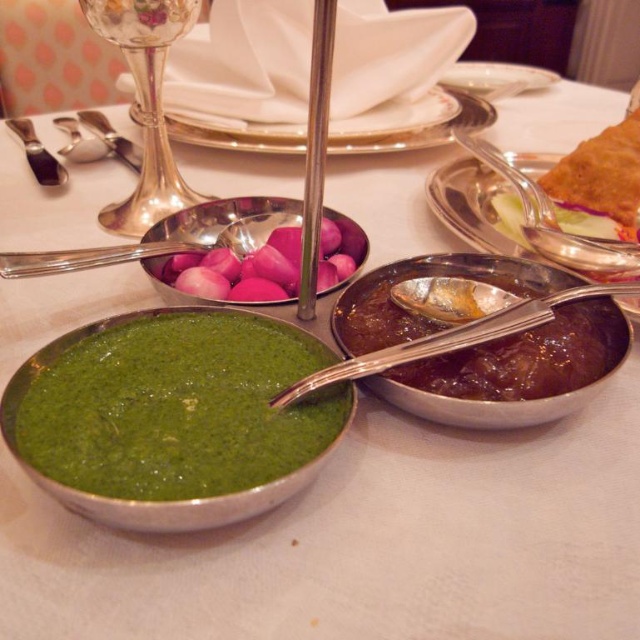
Question: Considering the real-world distances, which object is closest to the brushed metal butter knife at upper left?

Choices:
 (A) pink glossy onion at center
 (B) green matte bowl at lower left

Answer: (A)

Question: Does green matte bowl at lower left have a lesser width compared to metallic silver plate at center?

Choices:
 (A) no
 (B) yes

Answer: (B)

Question: Estimate the real-world distances between objects in this image. Which object is farther from the pink glossy onion at center?

Choices:
 (A) shiny metallic bowl at center
 (B) white porcelain plate at upper center
 (C) green matte bowl at lower left
 (D) shiny metal spoon at center

Answer: (B)

Question: Which point is closer to the camera?

Choices:
 (A) brushed metal butter knife at upper left
 (B) white porcelain plate at upper center
 (C) shiny metal spoon at center
 (D) pink glossy onion at center

Answer: (C)

Question: Is shiny metal spoon at center smaller than brushed metal butter knife at upper left?

Choices:
 (A) yes
 (B) no

Answer: (A)

Question: Does metallic silver plate at center lie behind brushed metal butter knife at upper left?

Choices:
 (A) no
 (B) yes

Answer: (B)